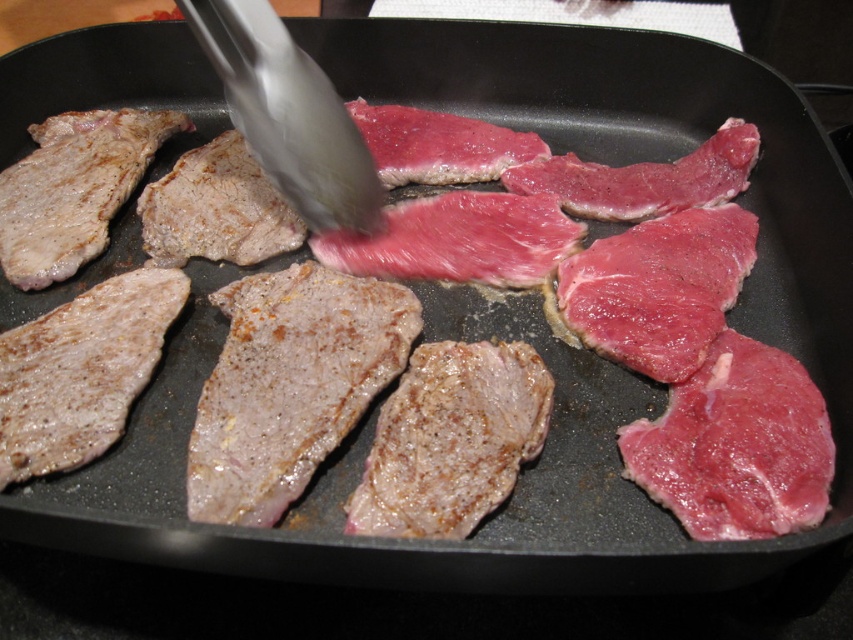
Question: Which object is closer to the camera taking this photo?

Choices:
 (A) pink raw meat at center
 (B) silver metallic tong at center

Answer: (A)

Question: Can you confirm if pink raw meat at center is positioned to the right of silver metallic tong at center?

Choices:
 (A) no
 (B) yes

Answer: (B)

Question: Can you confirm if pink raw meat at center is wider than silver metallic tong at center?

Choices:
 (A) no
 (B) yes

Answer: (B)

Question: Which object is farther from the camera taking this photo?

Choices:
 (A) pink raw meat at center
 (B) silver metallic tong at center

Answer: (B)

Question: Does pink raw meat at center have a greater width compared to silver metallic tong at center?

Choices:
 (A) yes
 (B) no

Answer: (A)